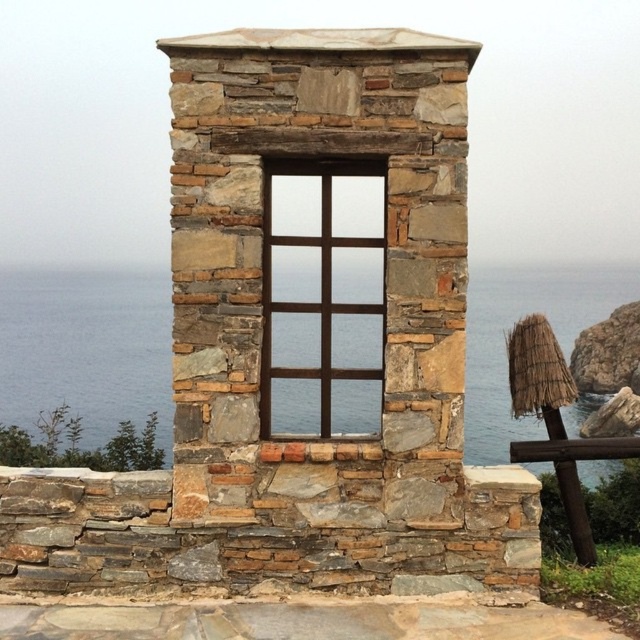
Question: Which object appears closest to the camera in this image?

Choices:
 (A) transparent glass water at center
 (B) brown wooden window at center

Answer: (A)

Question: Which object is closer to the camera taking this photo?

Choices:
 (A) transparent glass water at center
 (B) brown wooden window at center
 (C) natural stone window at center

Answer: (C)

Question: Which object is farther from the camera taking this photo?

Choices:
 (A) natural stone window at center
 (B) brown wooden window at center

Answer: (B)

Question: Does natural stone window at center have a lesser width compared to transparent glass water at center?

Choices:
 (A) yes
 (B) no

Answer: (A)

Question: Is natural stone window at center to the right of transparent glass water at center from the viewer's perspective?

Choices:
 (A) no
 (B) yes

Answer: (A)

Question: Does natural stone window at center appear on the right side of brown wooden window at center?

Choices:
 (A) no
 (B) yes

Answer: (B)